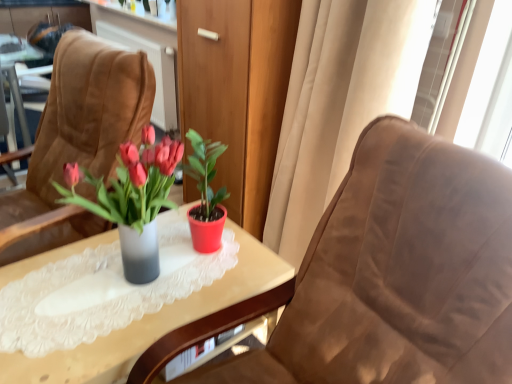
The height and width of the screenshot is (384, 512). Find the location of `vacant point above translucent glass vase at center (from a real-world perspective)`. vacant point above translucent glass vase at center (from a real-world perspective) is located at coordinates (127, 281).